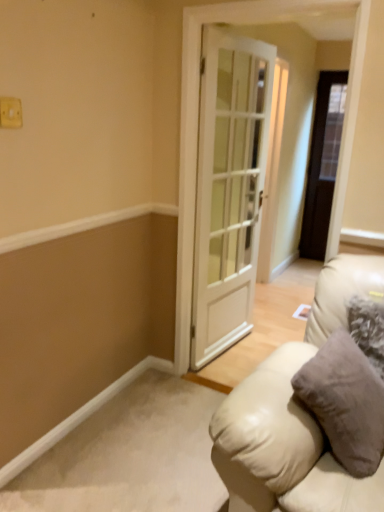
The height and width of the screenshot is (512, 384). Identify the location of white glass door at center, the 2th door in the right-to-left sequence. click(x=229, y=188).

Between white glass door at center, the 2th door in the right-to-left sequence, and beige leather couch at lower right, which one has larger size?

beige leather couch at lower right is bigger.

From a real-world perspective, is white glass door at center, the 2th door in the right-to-left sequence, positioned under beige leather couch at lower right based on gravity?

No, from a real-world perspective, white glass door at center, the 2th door in the right-to-left sequence, is not under beige leather couch at lower right.

Is white plastic light switch at upper left wider or thinner than beige leather couch at lower right?

white plastic light switch at upper left is thinner than beige leather couch at lower right.

Is white plastic light switch at upper left spatially inside beige leather couch at lower right, or outside of it?

white plastic light switch at upper left lies outside beige leather couch at lower right.

From the image's perspective, which is below, white plastic light switch at upper left or beige leather couch at lower right?

beige leather couch at lower right appears lower in the image.

Considering the sizes of objects beige leather couch at lower right and white plastic light switch at upper left in the image provided, who is taller, beige leather couch at lower right or white plastic light switch at upper left?

beige leather couch at lower right is taller.

From the image's perspective, which is below, beige leather couch at lower right or white plastic light switch at upper left?

beige leather couch at lower right, from the image's perspective.

Which of these two, beige leather couch at lower right or white plastic light switch at upper left, is wider?

With larger width is beige leather couch at lower right.

Is beige leather couch at lower right located outside white plastic light switch at upper left?

Yes, beige leather couch at lower right is not within white plastic light switch at upper left.

Looking at the image, does white glass door at center, the 1th door from the left, seem bigger or smaller compared to dark wood door at right, which is the 1th door in back-to-front order?

white glass door at center, the 1th door from the left, is bigger than dark wood door at right, which is the 1th door in back-to-front order.

From the picture: Does white glass door at center, the 2th door in the right-to-left sequence, have a greater height compared to dark wood door at right, placed as the 1th door when sorted from right to left?

No.

Visually, is white glass door at center, the 2th door in the back-to-front sequence, positioned to the left or to the right of dark wood door at right, which is the 1th door in back-to-front order?

Clearly, white glass door at center, the 2th door in the back-to-front sequence, is on the left of dark wood door at right, which is the 1th door in back-to-front order, in the image.

Is white glass door at center, the 2th door in the right-to-left sequence, surrounding dark wood door at right, arranged as the 2th door when viewed from the left?

No.

Considering the positions of objects beige leather couch at lower right and white glass door at center, the 2th door in the right-to-left sequence, in the image provided, who is more to the left, beige leather couch at lower right or white glass door at center, the 2th door in the right-to-left sequence,?

Positioned to the left is white glass door at center, the 2th door in the right-to-left sequence.

Would you say beige leather couch at lower right is outside white glass door at center, the 1th door from the left?

Yes, beige leather couch at lower right is not within white glass door at center, the 1th door from the left.

From a real-world perspective, who is located higher, beige leather couch at lower right or white glass door at center, the 2th door in the right-to-left sequence?

white glass door at center, the 2th door in the right-to-left sequence.

Is dark wood door at right, placed as the 1th door when sorted from right to left, completely or partially outside of beige leather couch at lower right?

dark wood door at right, placed as the 1th door when sorted from right to left, lies outside beige leather couch at lower right's area.

Does dark wood door at right, which is the 1th door in back-to-front order, touch beige leather couch at lower right?

dark wood door at right, which is the 1th door in back-to-front order, and beige leather couch at lower right are clearly separated.

From the image's perspective, is dark wood door at right, placed as the 1th door when sorted from right to left, positioned above or below beige leather couch at lower right?

From the image's perspective, dark wood door at right, placed as the 1th door when sorted from right to left, appears above beige leather couch at lower right.

From the picture: Can you confirm if dark wood door at right, arranged as the 2th door when viewed from the left, is shorter than beige leather couch at lower right?

In fact, dark wood door at right, arranged as the 2th door when viewed from the left, may be taller than beige leather couch at lower right.

Is white plastic light switch at upper left not within white glass door at center, the 1th door from the left?

Indeed, white plastic light switch at upper left is completely outside white glass door at center, the 1th door from the left.

Which is in front, white plastic light switch at upper left or white glass door at center, the 1th door from the left?

white plastic light switch at upper left.

Considering the positions of objects white plastic light switch at upper left and white glass door at center, arranged as the first door when viewed from the front, in the image provided, who is more to the left, white plastic light switch at upper left or white glass door at center, arranged as the first door when viewed from the front,?

white plastic light switch at upper left is more to the left.

Is point (4, 111) less distant than point (224, 269)?

Yes, it is.

At what (x,y) coordinates should I click in order to perform the action: click on studio couch in front of the white glass door at center, the 2th door in the back-to-front sequence. Please return your answer as a coordinate pair (x, y). Looking at the image, I should click on (294, 416).

At what (x,y) coordinates should I click in order to perform the action: click on studio couch lying on the right of white plastic light switch at upper left. Please return your answer as a coordinate pair (x, y). Image resolution: width=384 pixels, height=512 pixels. Looking at the image, I should click on (294, 416).

When comparing their distances from white glass door at center, the 2th door in the back-to-front sequence, does beige leather couch at lower right or dark wood door at right, which is the 1th door in back-to-front order, seem further?

dark wood door at right, which is the 1th door in back-to-front order, is further to white glass door at center, the 2th door in the back-to-front sequence.

Considering their positions, is white plastic light switch at upper left positioned closer to beige leather couch at lower right than dark wood door at right, marked as the second door in a front-to-back arrangement?

white plastic light switch at upper left lies closer to beige leather couch at lower right than the other object.

Considering their positions, is white plastic light switch at upper left positioned closer to dark wood door at right, marked as the second door in a front-to-back arrangement, than beige leather couch at lower right?

The object closer to dark wood door at right, marked as the second door in a front-to-back arrangement, is beige leather couch at lower right.

When comparing their distances from beige leather couch at lower right, does white glass door at center, arranged as the first door when viewed from the front, or white plastic light switch at upper left seem further?

Among the two, white plastic light switch at upper left is located further to beige leather couch at lower right.

From the image, which object appears to be farther from dark wood door at right, marked as the second door in a front-to-back arrangement, beige leather couch at lower right or white plastic light switch at upper left?

The object further to dark wood door at right, marked as the second door in a front-to-back arrangement, is white plastic light switch at upper left.

Considering their positions, is beige leather couch at lower right positioned further to white glass door at center, arranged as the first door when viewed from the front, than white plastic light switch at upper left?

Among the two, white plastic light switch at upper left is located further to white glass door at center, arranged as the first door when viewed from the front.

When comparing their distances from white glass door at center, the 2th door in the back-to-front sequence, does white plastic light switch at upper left or beige leather couch at lower right seem further?

white plastic light switch at upper left is further to white glass door at center, the 2th door in the back-to-front sequence.

Estimate the real-world distances between objects in this image. Which object is closer to white glass door at center, the 2th door in the back-to-front sequence, white plastic light switch at upper left or dark wood door at right, which is the 1th door in back-to-front order?

white plastic light switch at upper left is closer to white glass door at center, the 2th door in the back-to-front sequence.

You are a GUI agent. You are given a task and a screenshot of the screen. Output one action in this format:
    pyautogui.click(x=<x>, y=<y>)
    Task: Click on the door between white plastic light switch at upper left and dark wood door at right, placed as the 1th door when sorted from right to left, in the front-back direction
    The width and height of the screenshot is (384, 512).
    Given the screenshot: What is the action you would take?
    pyautogui.click(x=229, y=188)

In order to click on light switch located between beige leather couch at lower right and dark wood door at right, placed as the 1th door when sorted from right to left, in the depth direction in this screenshot , I will do `click(10, 112)`.

At what (x,y) coordinates should I click in order to perform the action: click on door between beige leather couch at lower right and dark wood door at right, placed as the 1th door when sorted from right to left, in the front-back direction. Please return your answer as a coordinate pair (x, y). This screenshot has width=384, height=512. Looking at the image, I should click on (229, 188).

Where is `light switch between beige leather couch at lower right and white glass door at center, arranged as the first door when viewed from the front, from front to back`? light switch between beige leather couch at lower right and white glass door at center, arranged as the first door when viewed from the front, from front to back is located at coordinates (10, 112).